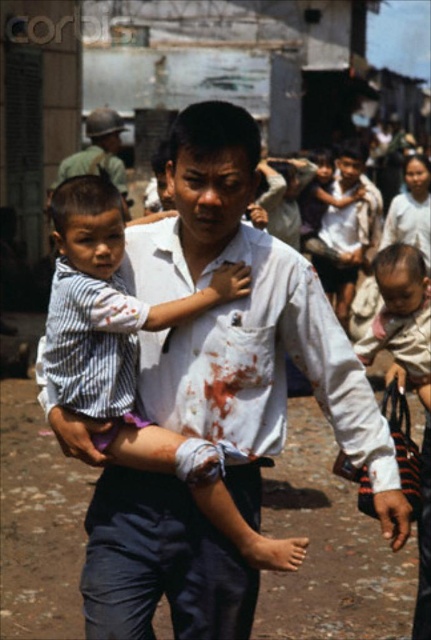
You are a photographer documenting the scene. You need to capture a photo where both the striped cotton shirt at center and the metallic helmet at upper left are clearly visible. Based on their positions, which object should you focus on first to ensure both are in frame?

The striped cotton shirt at center is located below the metallic helmet at upper left. To ensure both are in frame, focus on the metallic helmet at upper left first, as it is positioned higher up, allowing the camera to capture the lower positioned striped cotton shirt at center within the same shot.